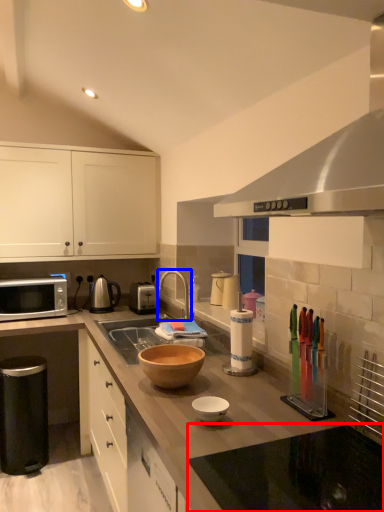
Question: Which object appears farthest to the camera in this image, countertop (highlighted by a red box) or tap (highlighted by a blue box)?

Choices:
 (A) countertop
 (B) tap

Answer: (B)